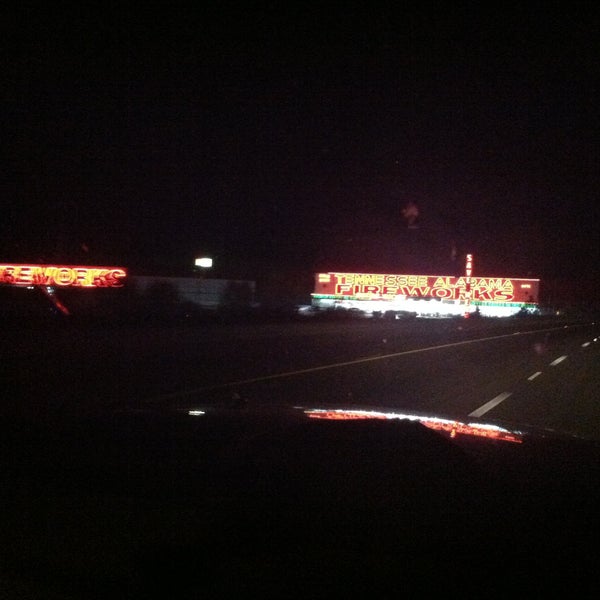
Where is `lit up sign`? lit up sign is located at coordinates (58, 275), (420, 282), (468, 265).